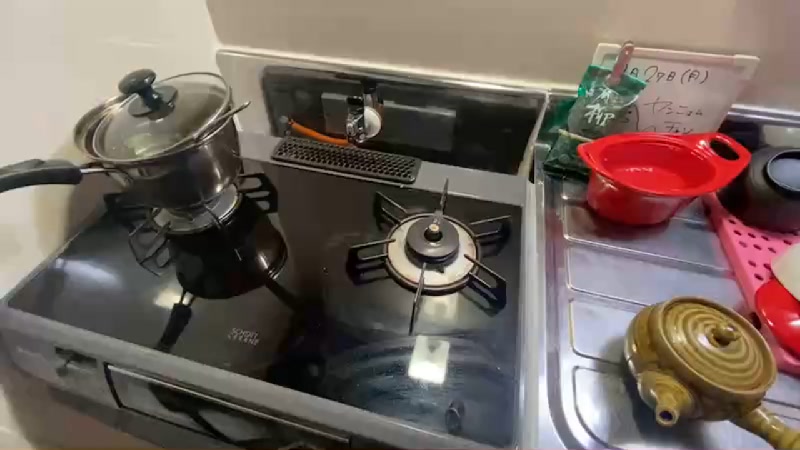
Image resolution: width=800 pixels, height=450 pixels. Identify the location of upside down black bowl on pin dish drying mat. (773, 196).